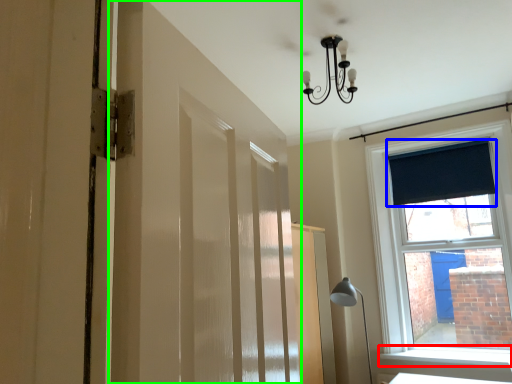
Question: Considering the real-world distances, which object is closest to window sill (highlighted by a red box)? curtain (highlighted by a blue box) or barn door (highlighted by a green box).

Choices:
 (A) curtain
 (B) barn door

Answer: (A)